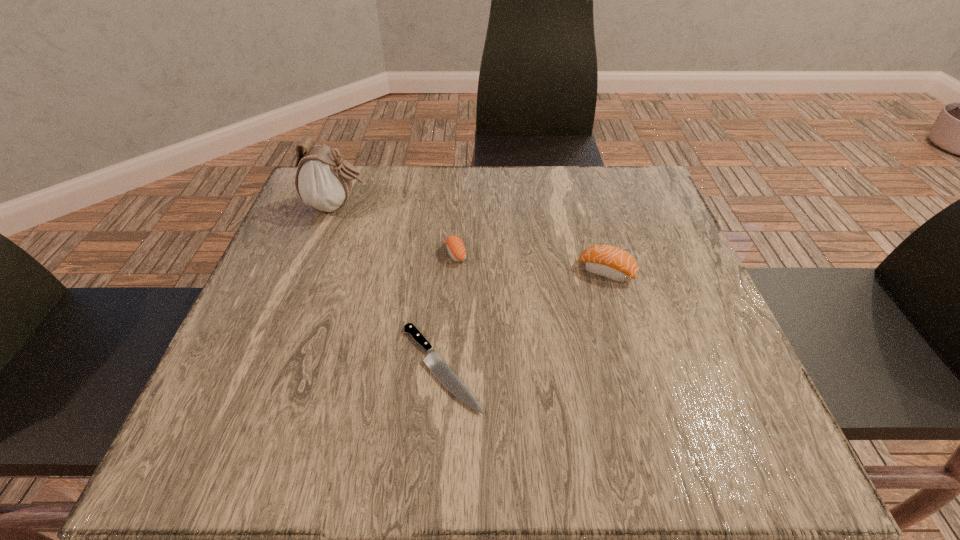
Where is `free space between the right sushi and the second shortest object`? free space between the right sushi and the second shortest object is located at coordinates (531, 262).

Identify the location of vacant point located between the nearest object and the shorter sushi. (449, 310).

I want to click on vacant area between the farthest object and the second shortest object, so click(x=397, y=230).

Where is `vacant area that lies between the leftmost object and the third tallest object`? This screenshot has width=960, height=540. vacant area that lies between the leftmost object and the third tallest object is located at coordinates (x=397, y=230).

This screenshot has height=540, width=960. What are the coordinates of `the second closest object to the shortest object` in the screenshot? It's located at (607, 261).

Find the location of a particular element. object that is the second closest to the right sushi is located at coordinates (456, 249).

Locate an element on the screen. free space in the image that satisfies the following two spatial constraints: 1. on the front-facing side of the pouch; 2. on the back side of the shorter sushi is located at coordinates (321, 254).

The height and width of the screenshot is (540, 960). What are the coordinates of `vacant space that satisfies the following two spatial constraints: 1. on the front-facing side of the steak knife; 2. on the left side of the farthest object` in the screenshot? It's located at (278, 368).

Locate an element on the screen. The height and width of the screenshot is (540, 960). vacant space that satisfies the following two spatial constraints: 1. on the front side of the shorter sushi; 2. on the right side of the second tallest object is located at coordinates (455, 271).

The image size is (960, 540). I want to click on free spot that satisfies the following two spatial constraints: 1. on the front-facing side of the farthest object; 2. on the back side of the left sushi, so [321, 254].